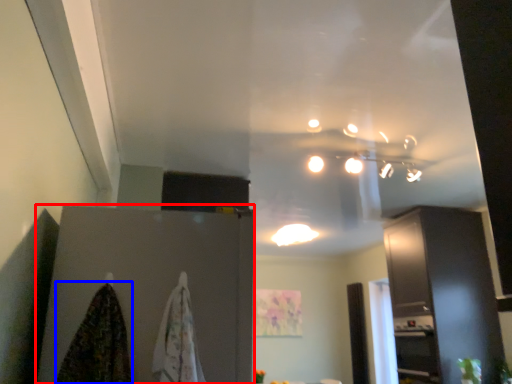
Question: Which of the following is the closest to the observer, cabinetry (highlighted by a red box) or blanket (highlighted by a blue box)?

Choices:
 (A) cabinetry
 (B) blanket

Answer: (B)